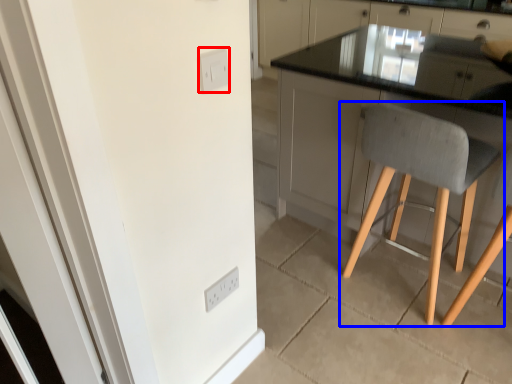
Question: Which object is further to the camera taking this photo, light switch (highlighted by a red box) or chair (highlighted by a blue box)?

Choices:
 (A) light switch
 (B) chair

Answer: (B)